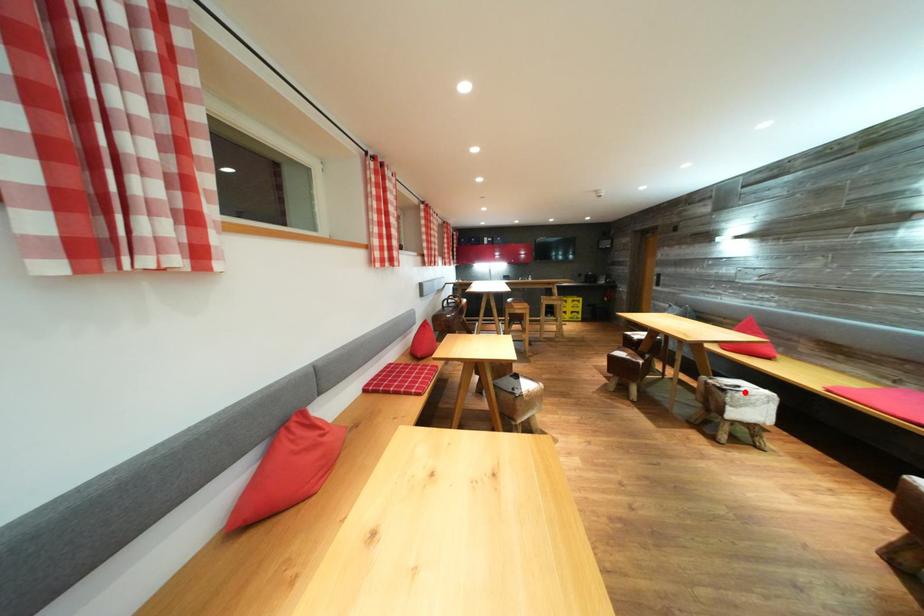
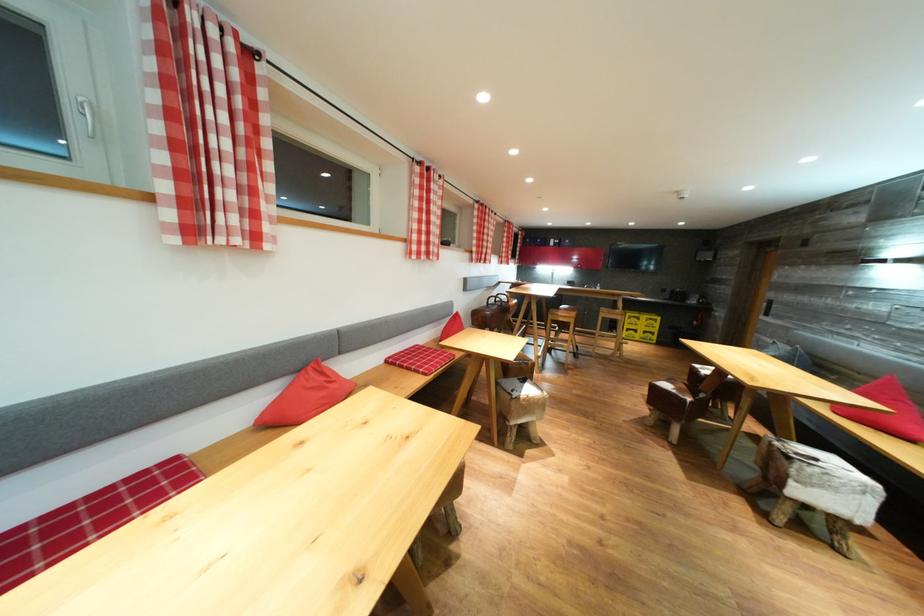
The point at the highlighted location is marked in the first image. Where is the corresponding point in the second image?

(821, 464)